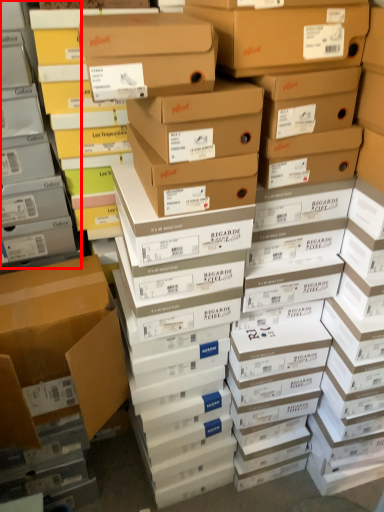
Question: From the image's perspective, considering the relative positions of shelf (annotated by the red box) and box in the image provided, where is shelf (annotated by the red box) located with respect to the staircase?

Choices:
 (A) above
 (B) below

Answer: (A)